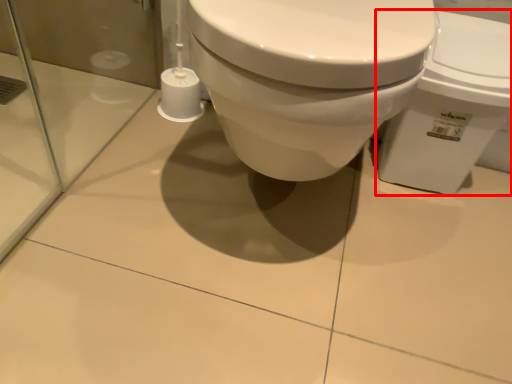
Question: Considering the relative positions of toilet (annotated by the red box) and toilet paper in the image provided, where is toilet (annotated by the red box) located with respect to the staircase?

Choices:
 (A) right
 (B) left

Answer: (A)